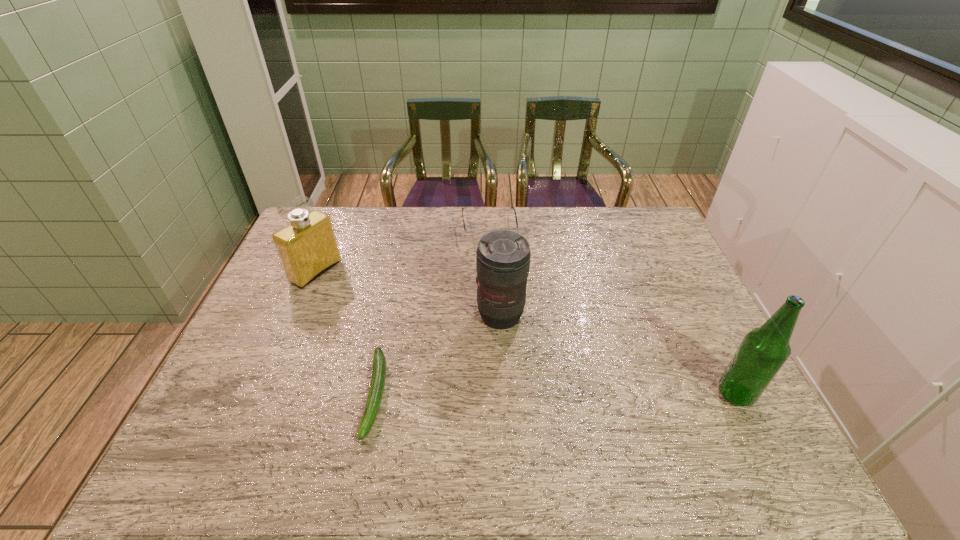
Identify which object is located as the nearest to the shortest object. Please provide its 2D coordinates. Your answer should be formatted as a tuple, i.e. [(x, y)], where the tuple contains the x and y coordinates of a point satisfying the conditions above.

[(503, 257)]

Choose which object is the second nearest neighbor to the tallest object. Please provide its 2D coordinates. Your answer should be formatted as a tuple, i.e. [(x, y)], where the tuple contains the x and y coordinates of a point satisfying the conditions above.

[(474, 236)]

This screenshot has width=960, height=540. Identify the location of free point that satisfies the following two spatial constraints: 1. on the front side of the telephoto lens; 2. on the label of the tallest object. (504, 394).

Locate an element on the screen. This screenshot has height=540, width=960. free space that satisfies the following two spatial constraints: 1. on the front side of the spectacles; 2. on the label of the tallest object is located at coordinates (493, 394).

Find the location of a particular element. This screenshot has height=540, width=960. vacant area that satisfies the following two spatial constraints: 1. on the front side of the beer bottle; 2. on the label of the third nearest object is located at coordinates (504, 394).